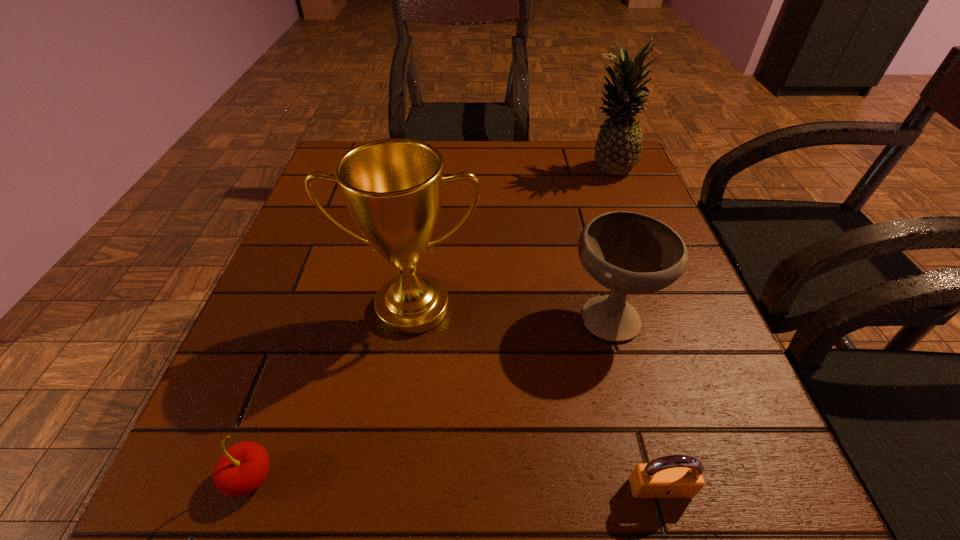
At what (x,y) coordinates should I click in order to perform the action: click on vacant area between the farthest object and the fourth object from right to left. Please return your answer as a coordinate pair (x, y). This screenshot has height=540, width=960. Looking at the image, I should click on (510, 237).

The width and height of the screenshot is (960, 540). In order to click on unoccupied position between the leftmost object and the award in this screenshot , I will do `click(331, 392)`.

Find the location of a particular element. unoccupied position between the award and the pineapple is located at coordinates (510, 237).

Image resolution: width=960 pixels, height=540 pixels. I want to click on free area in between the leftmost object and the shortest object, so click(455, 483).

Identify the location of the fourth closest object to the award. (618, 147).

I want to click on object that is the fourth closest to the award, so click(618, 147).